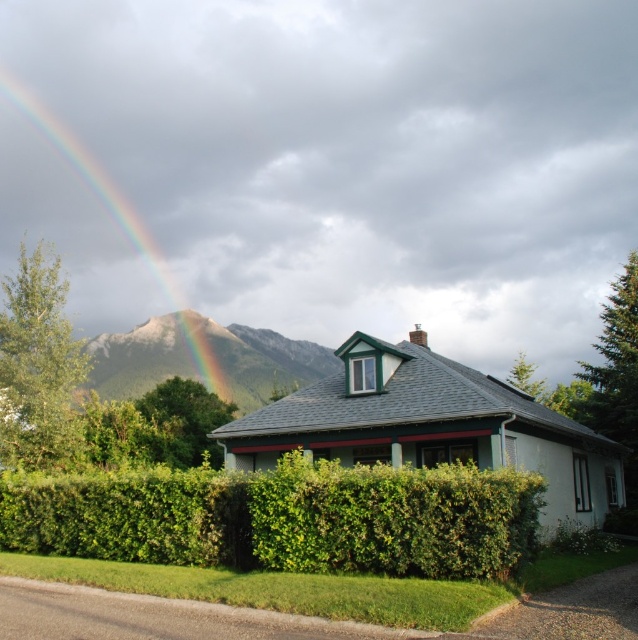
You are standing in front of the house and want to place a garden statue exactly at the center of the green leafy hedge at center. What are the coordinates where you should place it?

The green leafy hedge at center is located at point (285, 518), so you should place the garden statue at those coordinates.

You are a landscape architect designing a garden for this house. You need to place a 2m wide statue between the green leafy hedge at center and the rugged granite mountain at upper left. Which object should the statue be closer to to ensure it fits within the space?

The green leafy hedge at center is thinner than the rugged granite mountain at upper left, so the statue should be placed closer to the green leafy hedge at center to ensure it fits within the available space.